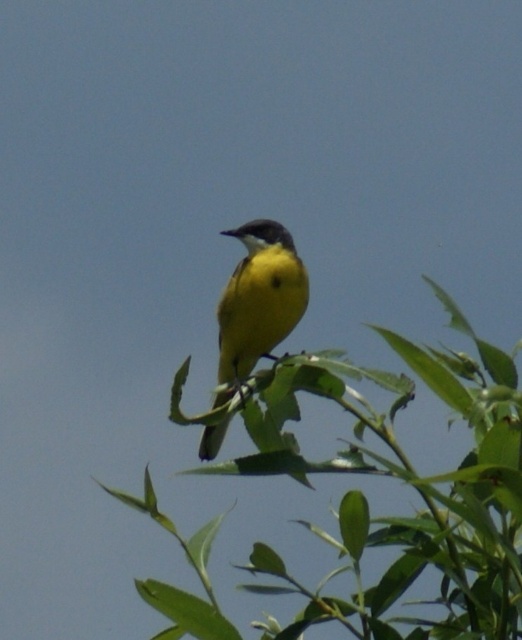
You are a photographer aiming to capture the yellow matte bird at center clearly. The green leafy branch at center is blocking part of the bird. Can you adjust your position to ensure the bird is fully visible without the branch obscuring it?

The green leafy branch at center is in front of the yellow matte bird at center, so moving your position slightly to the side or angle your camera might allow you to see the bird without the branch blocking it.

You are a photographer aiming to capture the yellow matte bird at center perched on the green leafy branch at center. Based on the scene, can you confirm if the bird is sitting on the branch?

The green leafy branch at center is positioned under the yellow matte bird at center, so yes, the bird is sitting on the branch.

You are a photographer aiming to capture the yellow matte bird at center. To ensure the bird is in focus, you need to know its position relative to the green leafy branch at center. Is the bird positioned to the left or right of the branch?

The green leafy branch at center is to the right of the yellow matte bird at center, so the bird is positioned to the left of the branch.